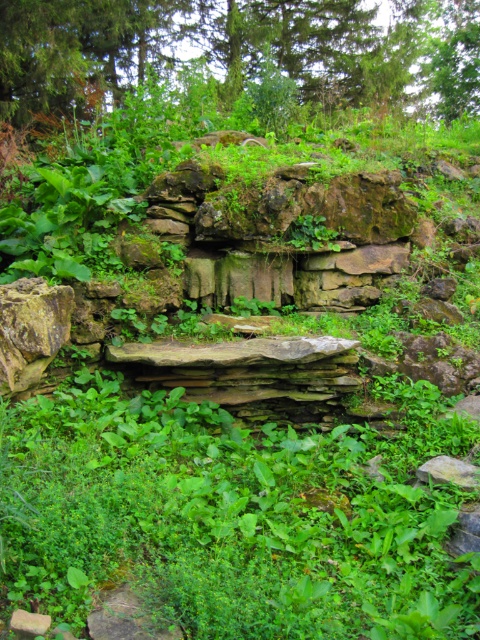
Question: Which point is closer to the camera?

Choices:
 (A) green leafy tree at upper center
 (B) green leafy grass at center

Answer: (B)

Question: Considering the relative positions of green leafy grass at center and green leafy tree at upper center in the image provided, where is green leafy grass at center located with respect to green leafy tree at upper center?

Choices:
 (A) left
 (B) right

Answer: (A)

Question: Is green leafy grass at center positioned in front of green leafy tree at upper center?

Choices:
 (A) yes
 (B) no

Answer: (A)

Question: Does green leafy grass at center appear on the right side of green leafy tree at upper center?

Choices:
 (A) yes
 (B) no

Answer: (B)